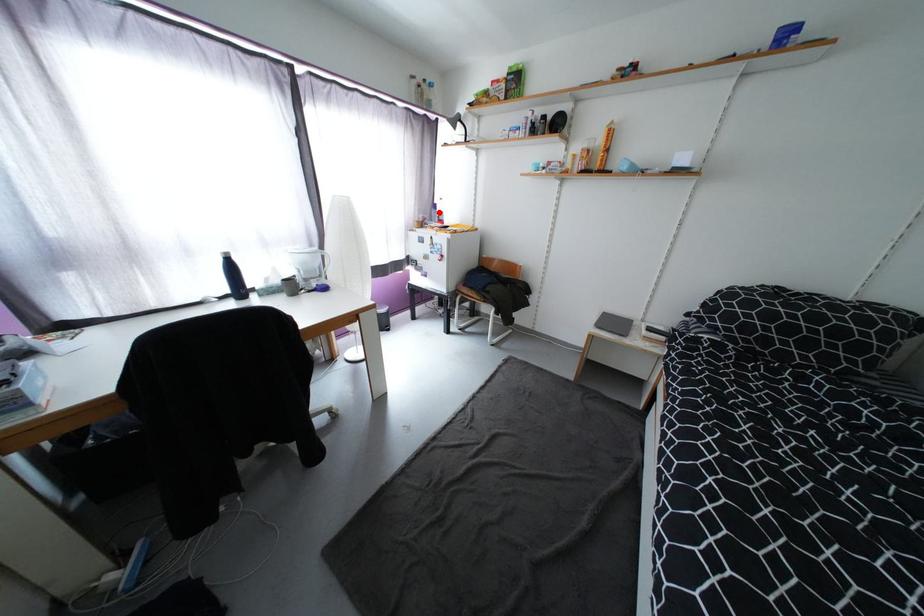
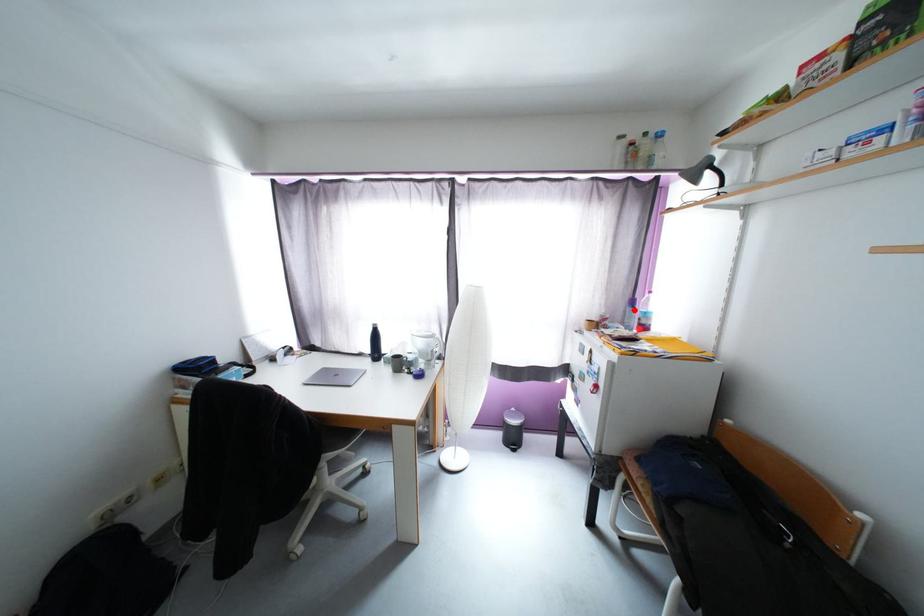
I am providing you with two images of the same scene from different viewpoints. A red point is marked on the first image and another point is marked on the second image. Is the red point in image1 aligned with the point shown in image2?

Yes